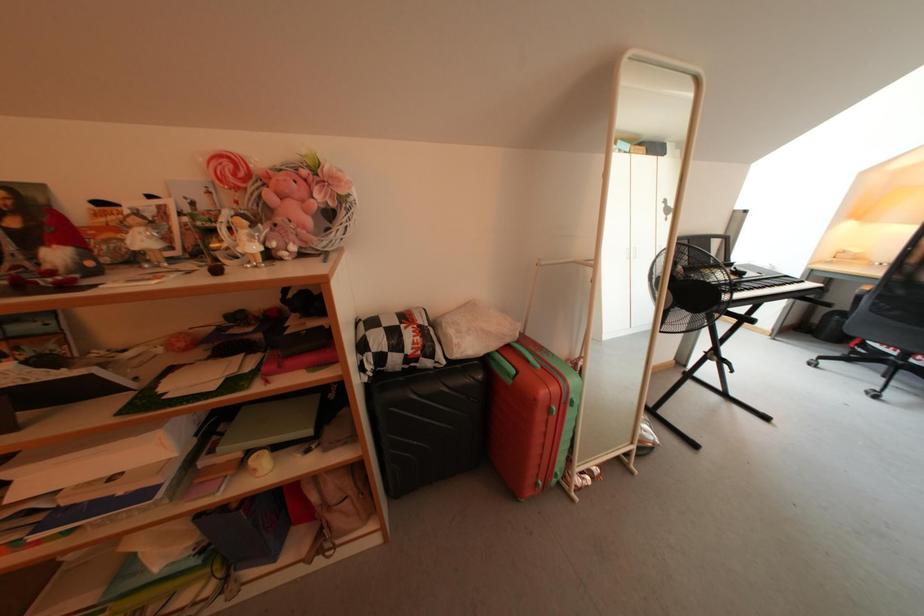
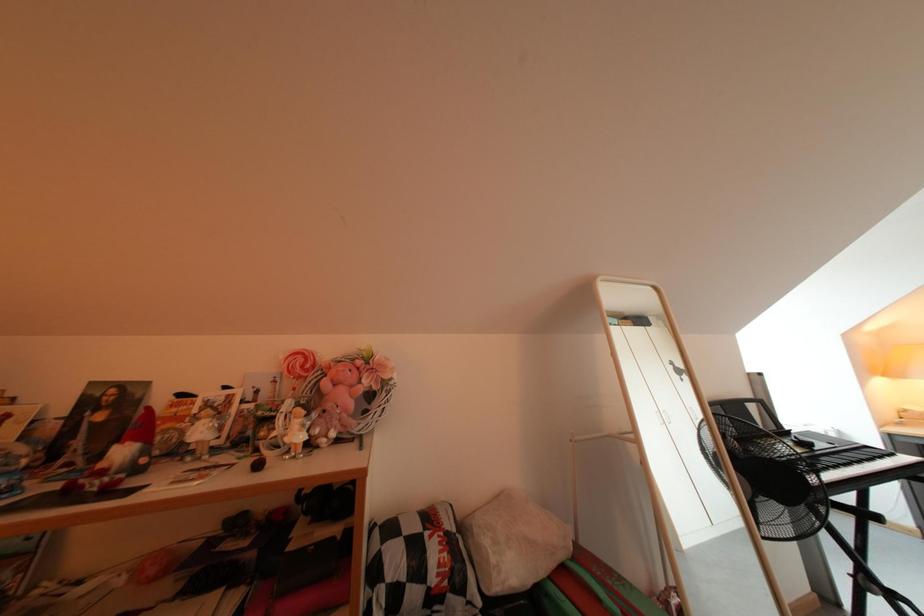
Question: The images are taken continuously from a first-person perspective. In which direction is your viewpoint rotating?

Choices:
 (A) Left
 (B) Right
 (C) Up
 (D) Down

Answer: (C)